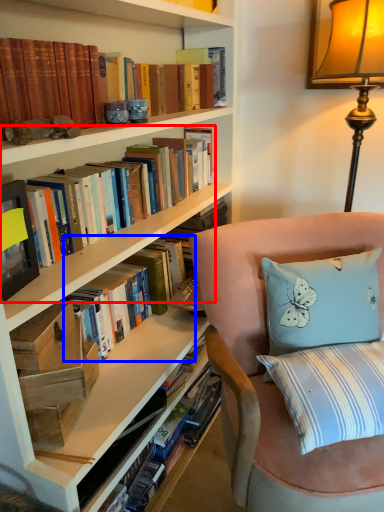
Question: Which object appears farthest to the camera in this image, book (highlighted by a red box) or book (highlighted by a blue box)?

Choices:
 (A) book
 (B) book

Answer: (B)